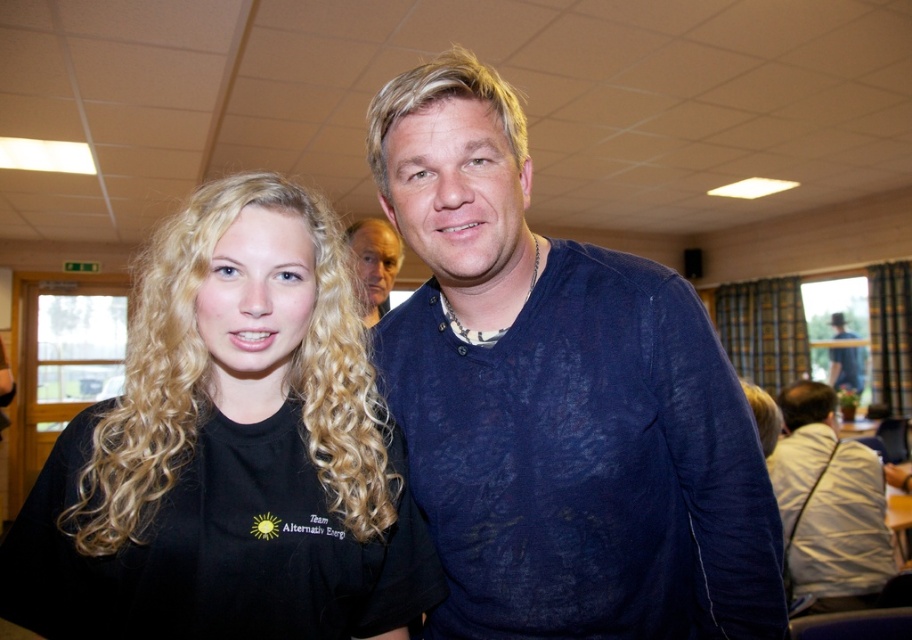
You are at a party and want to introduce yourself to the person wearing the blue cotton shirt at center. Which direction should you move relative to the black matte shirt at left?

The blue cotton shirt at center is positioned on the right side of the black matte shirt at left. So, you should move to the right of the black matte shirt at left to reach the blue cotton shirt at center.

What is located at the coordinate point (828,506) in the image?

The light beige fabric shirt at right is located at point (828,506).